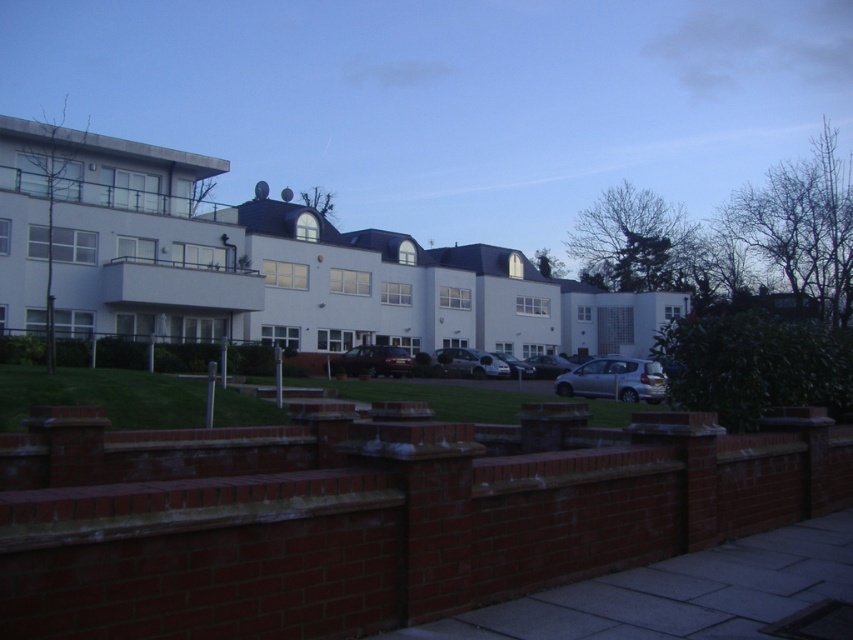
Question: Among these objects, which one is nearest to the camera?

Choices:
 (A) satin black car at center
 (B) metallic silver car at center

Answer: (A)

Question: Which of these objects is positioned farthest from the metallic silver car at center?

Choices:
 (A) shiny silver car at center
 (B) satin black car at center
 (C) satin silver car at center

Answer: (A)

Question: Is silver metallic car at lower right below metallic silver car at center?

Choices:
 (A) yes
 (B) no

Answer: (B)

Question: Can you confirm if silver metallic car at lower right is smaller than shiny silver car at center?

Choices:
 (A) yes
 (B) no

Answer: (A)

Question: Is metallic silver car at center above satin silver car at center?

Choices:
 (A) yes
 (B) no

Answer: (B)

Question: Which point appears closest to the camera in this image?

Choices:
 (A) (561, 358)
 (B) (579, 380)
 (C) (473, 360)
 (D) (532, 368)

Answer: (B)